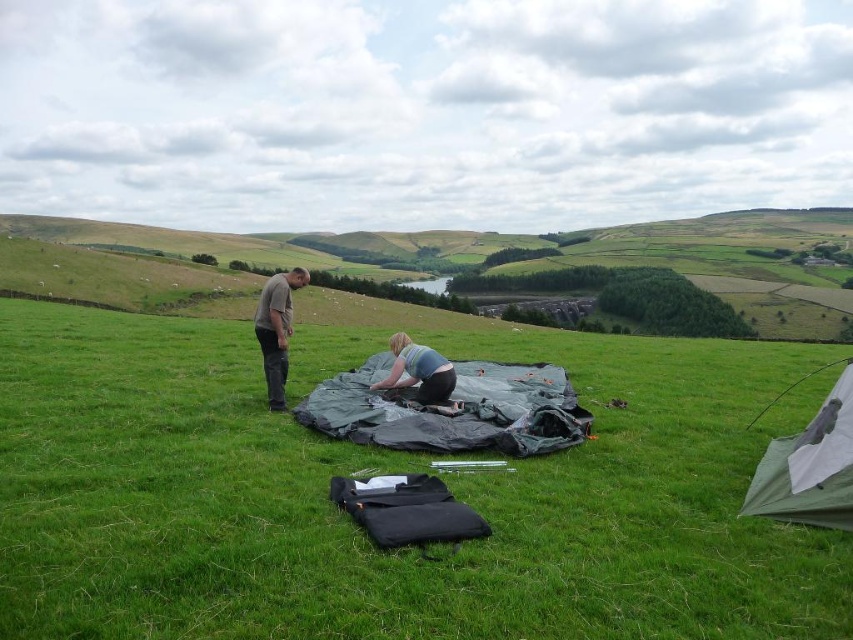
Question: Based on their relative distances, which object is farther from the light blue fabric at center?

Choices:
 (A) gray cotton shirt at left
 (B) green tarp at center

Answer: (A)

Question: Is green tarp at center closer to the viewer compared to gray cotton shirt at left?

Choices:
 (A) yes
 (B) no

Answer: (A)

Question: Which point is closer to the camera?

Choices:
 (A) green tarp at center
 (B) green fabric tent at center
 (C) light blue fabric at center

Answer: (B)

Question: Which point appears closest to the camera in this image?

Choices:
 (A) (399, 378)
 (B) (277, 396)

Answer: (B)

Question: Is green grassy field at center below green fabric tent at center?

Choices:
 (A) no
 (B) yes

Answer: (A)

Question: Does green grassy field at center lie in front of light blue fabric at center?

Choices:
 (A) no
 (B) yes

Answer: (B)